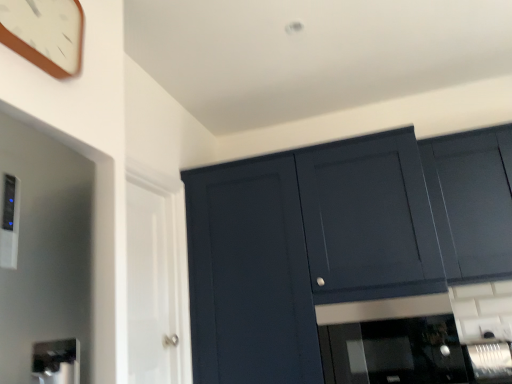
What do you see at coordinates (472, 202) in the screenshot?
I see `matte dark blue cabinet at upper right` at bounding box center [472, 202].

Locate an element on the screen. matte dark blue cabinet at upper right is located at coordinates (472, 202).

What is the approximate height of white glossy door at left?

The height of white glossy door at left is 37.30 inches.

What do you see at coordinates (152, 277) in the screenshot? I see `white glossy door at left` at bounding box center [152, 277].

The width and height of the screenshot is (512, 384). What do you see at coordinates (393, 352) in the screenshot? I see `black glass microwave at center, marked as the 2th appliance in a right-to-left arrangement` at bounding box center [393, 352].

Based on the photo, measure the distance between point (334, 338) and camera.

1.94 meters.

The width and height of the screenshot is (512, 384). Identify the location of wooden clock at upper left. (45, 33).

Can you confirm if matte dark blue cabinet at upper right is wider than black glass microwave at center, marked as the 2th appliance in a right-to-left arrangement?

Yes, matte dark blue cabinet at upper right is wider than black glass microwave at center, marked as the 2th appliance in a right-to-left arrangement.

From the image's perspective, which is below, matte dark blue cabinet at upper right or black glass microwave at center, marked as the 2th appliance in a right-to-left arrangement?

black glass microwave at center, marked as the 2th appliance in a right-to-left arrangement, is shown below in the image.

Could you tell me if matte dark blue cabinet at upper right is facing black glass microwave at center, acting as the 1th appliance starting from the left?

Yes.

Who is shorter, matte dark blue cabinet at upper right or black glass microwave at center, marked as the 2th appliance in a right-to-left arrangement?

black glass microwave at center, marked as the 2th appliance in a right-to-left arrangement.

Between wooden clock at upper left and matte dark blue cabinet at upper right, which one appears on the right side from the viewer's perspective?

From the viewer's perspective, matte dark blue cabinet at upper right appears more on the right side.

From the picture: From a real-world perspective, is wooden clock at upper left above or below matte dark blue cabinet at upper right?

wooden clock at upper left is above matte dark blue cabinet at upper right.

Is wooden clock at upper left oriented towards matte dark blue cabinet at upper right?

No, wooden clock at upper left is not turned towards matte dark blue cabinet at upper right.

Is wooden clock at upper left thinner than matte dark blue cabinet at upper right?

Correct, the width of wooden clock at upper left is less than that of matte dark blue cabinet at upper right.

Can you tell me how much matte dark blue cabinet at upper right and satin silver appliance at lower right, which appears as the second appliance when viewed from the left, differ in facing direction?

The facing directions of matte dark blue cabinet at upper right and satin silver appliance at lower right, which appears as the second appliance when viewed from the left, are 1.41 degrees apart.

From the image's perspective, is matte dark blue cabinet at upper right on top of satin silver appliance at lower right, which appears as the second appliance when viewed from the left?

Yes, from the image's perspective, matte dark blue cabinet at upper right is on top of satin silver appliance at lower right, which appears as the second appliance when viewed from the left.

Where is `cabinetry that is above the satin silver appliance at lower right, the first appliance viewed from the right (from the image's perspective)`? This screenshot has height=384, width=512. cabinetry that is above the satin silver appliance at lower right, the first appliance viewed from the right (from the image's perspective) is located at coordinates (472, 202).

From the picture: Considering their positions, is matte dark blue cabinet at upper right located in front of or behind satin silver appliance at lower right, the first appliance viewed from the right?

In the image, matte dark blue cabinet at upper right appears behind satin silver appliance at lower right, the first appliance viewed from the right.

Is point (462, 196) closer to camera compared to point (146, 297)?

No, (462, 196) is further to viewer.

Is matte dark blue cabinet at upper right situated inside white glossy door at left or outside?

The correct answer is: outside.

Is matte dark blue cabinet at upper right taller than white glossy door at left?

In fact, matte dark blue cabinet at upper right may be shorter than white glossy door at left.

Based on the photo, does matte dark blue cabinet at upper right touch white glossy door at left?

There is a gap between matte dark blue cabinet at upper right and white glossy door at left.

Is point (154, 347) closer to viewer compared to point (230, 231)?

Yes, point (154, 347) is closer to viewer.

This screenshot has height=384, width=512. I want to click on cupboard lying on the right of white glossy door at left, so click(335, 240).

Is white glossy door at left wider or thinner than matte dark blue cabinet at upper right?

In the image, white glossy door at left appears to be more narrow than matte dark blue cabinet at upper right.

Is white glossy door at left completely or partially outside of matte dark blue cabinet at upper right?

white glossy door at left is positioned outside matte dark blue cabinet at upper right.

Which of these two, wooden clock at upper left or black glass microwave at center, acting as the 1th appliance starting from the left, is thinner?

Thinner between the two is wooden clock at upper left.

Is wooden clock at upper left aimed at black glass microwave at center, acting as the 1th appliance starting from the left?

No, wooden clock at upper left does not turn towards black glass microwave at center, acting as the 1th appliance starting from the left.

Is wooden clock at upper left not near black glass microwave at center, marked as the 2th appliance in a right-to-left arrangement?

That's right, there is a large distance between wooden clock at upper left and black glass microwave at center, marked as the 2th appliance in a right-to-left arrangement.

Is point (23, 41) farther from viewer compared to point (330, 368)?

No, (23, 41) is in front of (330, 368).

Between point (481, 195) and point (388, 351), which one is positioned behind?

The point (481, 195) is farther.

Is matte dark blue cabinet at upper right closer to the viewer compared to black glass microwave at center, acting as the 1th appliance starting from the left?

No, matte dark blue cabinet at upper right is behind black glass microwave at center, acting as the 1th appliance starting from the left.

Can you confirm if matte dark blue cabinet at upper right is wider than black glass microwave at center, marked as the 2th appliance in a right-to-left arrangement?

No, matte dark blue cabinet at upper right is not wider than black glass microwave at center, marked as the 2th appliance in a right-to-left arrangement.

Can you confirm if matte dark blue cabinet at upper right is smaller than black glass microwave at center, acting as the 1th appliance starting from the left?

No.

Locate an element on the screen. The height and width of the screenshot is (384, 512). cupboard lying above the black glass microwave at center, acting as the 1th appliance starting from the left (from the image's perspective) is located at coordinates (335, 240).

Where is `clock lying in front of the matte dark blue cabinet at upper right`? clock lying in front of the matte dark blue cabinet at upper right is located at coordinates (45, 33).

Looking at the image, which one is located further to satin silver appliance at lower right, which appears as the second appliance when viewed from the left, wooden clock at upper left or matte dark blue cabinet at upper right?

wooden clock at upper left.

Looking at the image, which one is located further to black glass microwave at center, acting as the 1th appliance starting from the left, matte dark blue cabinet at upper right or white glossy door at left?

white glossy door at left is further to black glass microwave at center, acting as the 1th appliance starting from the left.

When comparing their distances from black glass microwave at center, acting as the 1th appliance starting from the left, does wooden clock at upper left or matte dark blue cabinet at upper right seem further?

Based on the image, wooden clock at upper left appears to be further to black glass microwave at center, acting as the 1th appliance starting from the left.

Based on their spatial positions, is matte dark blue cabinet at upper right or matte dark blue cabinet at upper right closer to black glass microwave at center, marked as the 2th appliance in a right-to-left arrangement?

matte dark blue cabinet at upper right.

Considering their positions, is matte dark blue cabinet at upper right positioned closer to wooden clock at upper left than satin silver appliance at lower right, which appears as the second appliance when viewed from the left?

matte dark blue cabinet at upper right is positioned closer to the anchor wooden clock at upper left.

Based on their spatial positions, is matte dark blue cabinet at upper right or matte dark blue cabinet at upper right closer to satin silver appliance at lower right, the first appliance viewed from the right?

Among the two, matte dark blue cabinet at upper right is located nearer to satin silver appliance at lower right, the first appliance viewed from the right.

Based on their spatial positions, is matte dark blue cabinet at upper right or black glass microwave at center, acting as the 1th appliance starting from the left, closer to satin silver appliance at lower right, which appears as the second appliance when viewed from the left?

black glass microwave at center, acting as the 1th appliance starting from the left, is positioned closer to the anchor satin silver appliance at lower right, which appears as the second appliance when viewed from the left.

Based on their spatial positions, is white glossy door at left or wooden clock at upper left closer to matte dark blue cabinet at upper right?

The object closer to matte dark blue cabinet at upper right is white glossy door at left.

At what (x,y) coordinates should I click in order to perform the action: click on appliance between matte dark blue cabinet at upper right and satin silver appliance at lower right, which appears as the second appliance when viewed from the left. Please return your answer as a coordinate pair (x, y). Image resolution: width=512 pixels, height=384 pixels. Looking at the image, I should click on (393, 352).

Where is `cupboard between wooden clock at upper left and black glass microwave at center, acting as the 1th appliance starting from the left, in the up-down direction`? cupboard between wooden clock at upper left and black glass microwave at center, acting as the 1th appliance starting from the left, in the up-down direction is located at coordinates (335, 240).

Find the location of a particular element. appliance between matte dark blue cabinet at upper right and satin silver appliance at lower right, the first appliance viewed from the right, in the vertical direction is located at coordinates [393, 352].

Where is `glass door between wooden clock at upper left and black glass microwave at center, acting as the 1th appliance starting from the left, in the horizontal direction`? This screenshot has width=512, height=384. glass door between wooden clock at upper left and black glass microwave at center, acting as the 1th appliance starting from the left, in the horizontal direction is located at coordinates (152, 277).